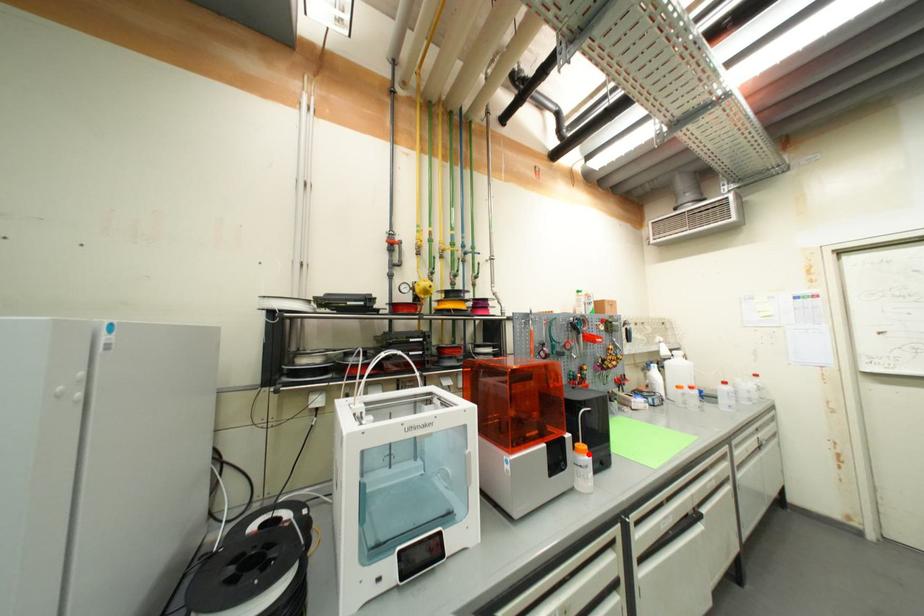
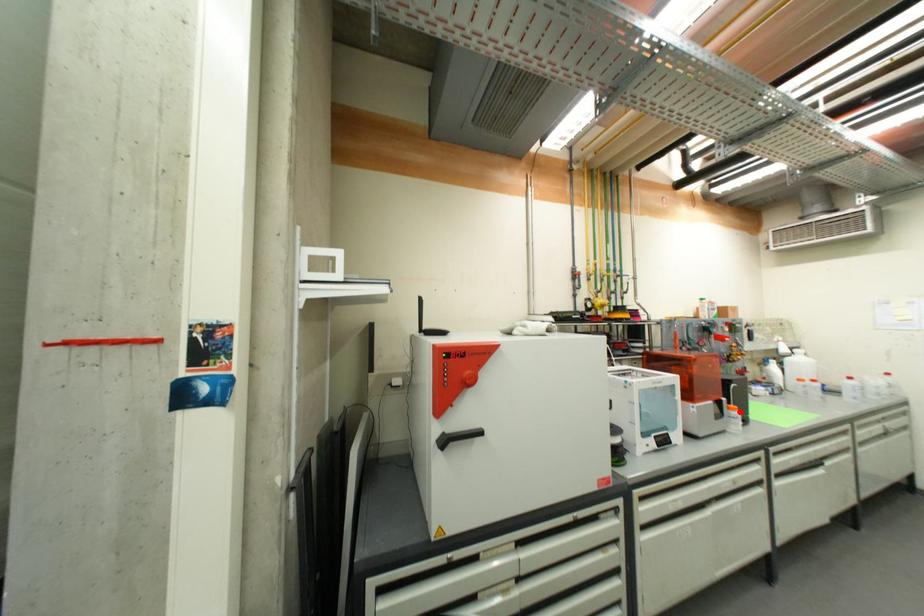
I am providing you with two images of the same scene from different viewpoints. A red point is marked on the first image and another point is marked on the second image. Is the marked point in image1 the same physical position as the marked point in image2?

Yes